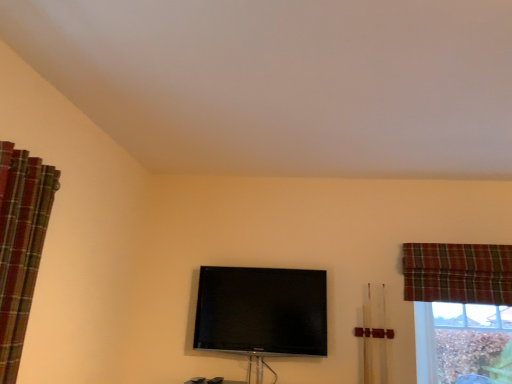
Question: Is plaid fabric curtain at upper right, arranged as the 1th curtain when viewed from the back, positioned far away from brown textured wood at lower right?

Choices:
 (A) no
 (B) yes

Answer: (A)

Question: Is plaid fabric curtain at upper right, acting as the second curtain starting from the left, beside brown textured wood at lower right?

Choices:
 (A) no
 (B) yes

Answer: (A)

Question: Is plaid fabric curtain at upper right, acting as the second curtain starting from the left, positioned in front of brown textured wood at lower right?

Choices:
 (A) no
 (B) yes

Answer: (B)

Question: Is plaid fabric curtain at upper right, placed as the 2th curtain when sorted from front to back, positioned with its back to brown textured wood at lower right?

Choices:
 (A) no
 (B) yes

Answer: (A)

Question: Is plaid fabric curtain at upper right, acting as the second curtain starting from the left, at the left side of brown textured wood at lower right?

Choices:
 (A) yes
 (B) no

Answer: (A)

Question: Can you confirm if plaid fabric curtain at upper right, which is counted as the 1th curtain, starting from the right, is bigger than brown textured wood at lower right?

Choices:
 (A) yes
 (B) no

Answer: (B)

Question: Does matte black tv at center have a lesser width compared to brown textured wood at lower right?

Choices:
 (A) yes
 (B) no

Answer: (B)

Question: Is matte black tv at center facing away from brown textured wood at lower right?

Choices:
 (A) no
 (B) yes

Answer: (A)

Question: Is matte black tv at center in front of brown textured wood at lower right?

Choices:
 (A) no
 (B) yes

Answer: (B)

Question: Does matte black tv at center lie behind brown textured wood at lower right?

Choices:
 (A) no
 (B) yes

Answer: (A)

Question: Can you confirm if matte black tv at center is taller than brown textured wood at lower right?

Choices:
 (A) no
 (B) yes

Answer: (A)

Question: From a real-world perspective, is matte black tv at center physically above brown textured wood at lower right?

Choices:
 (A) yes
 (B) no

Answer: (B)

Question: Considering the relative sizes of brown textured wood at lower right and plaid fabric curtain at left, marked as the 2th curtain in a right-to-left arrangement, in the image provided, is brown textured wood at lower right wider than plaid fabric curtain at left, marked as the 2th curtain in a right-to-left arrangement,?

Choices:
 (A) yes
 (B) no

Answer: (B)